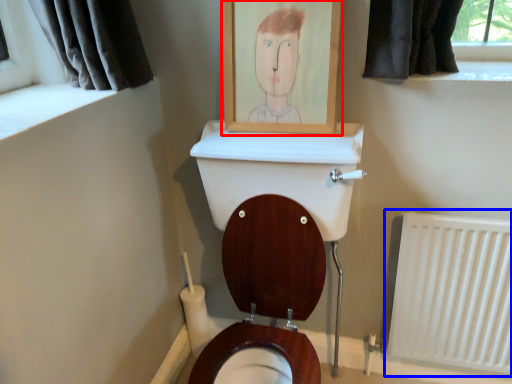
Question: Which object is closer to the camera taking this photo, picture frame (highlighted by a red box) or radiator (highlighted by a blue box)?

Choices:
 (A) picture frame
 (B) radiator

Answer: (A)